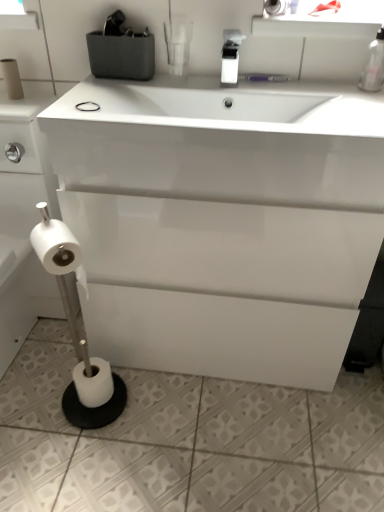
Identify the location of vacant area that is in front of white glossy cabinet at center. This screenshot has width=384, height=512. (213, 441).